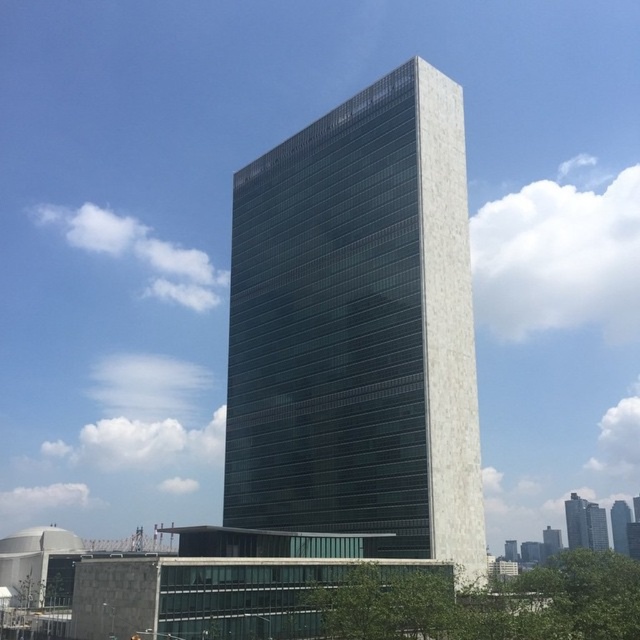
Question: Does glassy reflective skyscraper at center appear on the left side of white marble tower at center?

Choices:
 (A) no
 (B) yes

Answer: (B)

Question: In this image, where is matte glass tower at center located relative to glassy reflective skyscraper at center?

Choices:
 (A) above
 (B) below

Answer: (A)

Question: In this image, where is matte glass tower at center located relative to glassy reflective skyscraper at center?

Choices:
 (A) left
 (B) right

Answer: (A)

Question: Which point is farther from the camera taking this photo?

Choices:
 (A) (592, 536)
 (B) (570, 536)
 (C) (460, 538)

Answer: (B)

Question: Which of the following is the farthest from the observer?

Choices:
 (A) green glass skyscraper at center
 (B) matte glass tower at center
 (C) glassy reflective skyscraper at center
 (D) white marble tower at center

Answer: (A)

Question: Based on their relative distances, which object is farther from the white marble tower at center?

Choices:
 (A) glassy reflective skyscraper at center
 (B) green glass skyscraper at center
 (C) matte glass tower at center

Answer: (C)